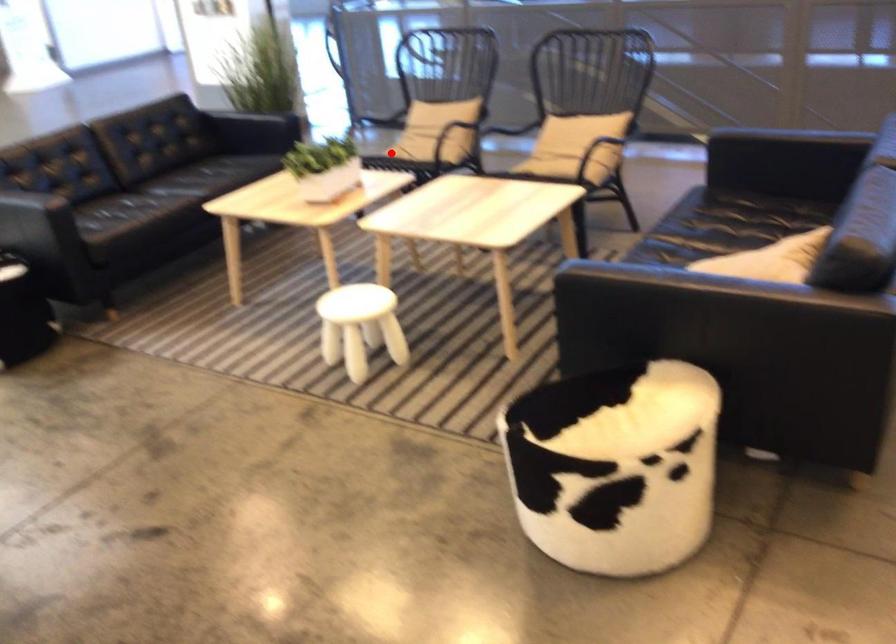
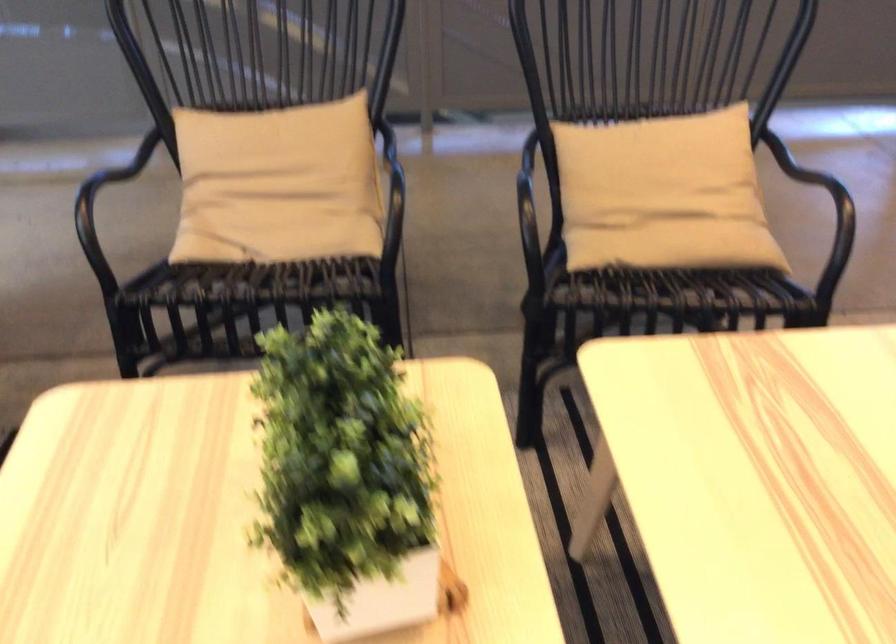
Question: A red point is marked in image1. In image2, is the corresponding 3D point closer to the camera or farther? Reply with the corresponding letter.

Choices:
 (A) The corresponding 3D point is closer.
 (B) The corresponding 3D point is farther.

Answer: (A)